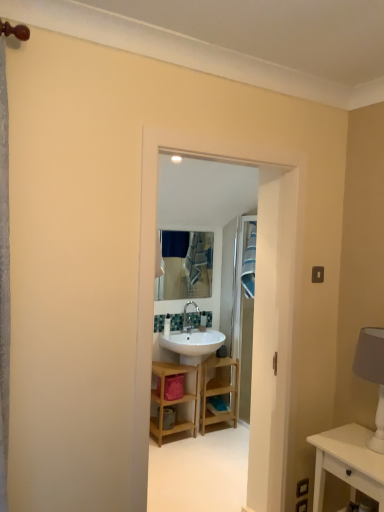
The image size is (384, 512). In order to click on wooden shelf at center in this screenshot , I will do `click(173, 400)`.

Measure the distance between white wood side table at lower right and camera.

The depth of white wood side table at lower right is 5.68 feet.

Measure the distance between blue fabric laundry at center and camera.

blue fabric laundry at center and camera are 3.49 meters apart from each other.

You are a GUI agent. You are given a task and a screenshot of the screen. Output one action in this format:
    pyautogui.click(x=<x>, y=<y>)
    Task: Click on the blue fabric laundry at center
    
    Given the screenshot: What is the action you would take?
    pyautogui.click(x=249, y=260)

What do you see at coordinates (186, 265) in the screenshot? The width and height of the screenshot is (384, 512). I see `metallic silver mirror at center` at bounding box center [186, 265].

Measure the distance between point (377, 362) and camera.

They are 1.91 meters apart.

Identify the location of wooden shelf at center. (173, 400).

Is blue fabric laundry at center with white wood side table at lower right?

There is a gap between blue fabric laundry at center and white wood side table at lower right.

Is the position of blue fabric laundry at center more distant than that of white wood side table at lower right?

That is True.

From a real-world perspective, who is located lower, blue fabric laundry at center or white wood side table at lower right?

From a 3D spatial view, white wood side table at lower right is below.

Is white wood side table at lower right completely or partially inside blue fabric laundry at center?

No.

Which of these two, wooden shelf at center or white wood side table at lower right, is bigger?

wooden shelf at center is bigger.

Can we say wooden shelf at center lies outside white wood side table at lower right?

wooden shelf at center lies outside white wood side table at lower right's area.

From the image's perspective, would you say wooden shelf at center is shown under white wood side table at lower right?

Yes, from the image's perspective, wooden shelf at center is beneath white wood side table at lower right.

Which of these two, wooden shelf at center or white wood side table at lower right, stands taller?

Standing taller between the two is wooden shelf at center.

Are wooden shelf at center and white wood side table at lower right located far from each other?

That's right, there is a large distance between wooden shelf at center and white wood side table at lower right.

From the image's perspective, is wooden shelf at center below white wood side table at lower right?

Yes, from the image's perspective, wooden shelf at center is below white wood side table at lower right.

Is wooden shelf at center wider than metallic silver mirror at center?

Yes, wooden shelf at center is wider than metallic silver mirror at center.

Is wooden shelf at center with metallic silver mirror at center?

wooden shelf at center is not next to metallic silver mirror at center, and they're not touching.

Is wooden shelf at center oriented towards metallic silver mirror at center?

No, wooden shelf at center is not turned towards metallic silver mirror at center.

Consider the image. Measure the distance from wooden shelf at center to metallic silver mirror at center.

wooden shelf at center and metallic silver mirror at center are 1.19 meters apart.

Consider the image. Can you tell me how much wooden shelf at center and blue fabric laundry at center differ in facing direction?

The angle between the facing direction of wooden shelf at center and the facing direction of blue fabric laundry at center is 85.5 degrees.

Looking at this image, measure the distance from wooden shelf at center to blue fabric laundry at center.

wooden shelf at center and blue fabric laundry at center are 34.49 inches apart from each other.

Is wooden shelf at center facing towards blue fabric laundry at center?

No, wooden shelf at center is not facing towards blue fabric laundry at center.

Considering the relative positions of wooden shelf at center and blue fabric laundry at center in the image provided, is wooden shelf at center in front of blue fabric laundry at center?

No.

From the image's perspective, who appears lower, white fabric lampshade at right or metallic silver mirror at center?

white fabric lampshade at right is shown below in the image.

Can you tell me how much white fabric lampshade at right and metallic silver mirror at center differ in facing direction?

The angle between the facing direction of white fabric lampshade at right and the facing direction of metallic silver mirror at center is 87.8 degrees.

Which object is positioned more to the right, white fabric lampshade at right or metallic silver mirror at center?

white fabric lampshade at right is more to the right.

Looking at this image, is white fabric lampshade at right aimed at metallic silver mirror at center?

No, white fabric lampshade at right does not turn towards metallic silver mirror at center.

Consider the image. Is white glossy sink at center positioned with its back to blue fabric laundry at center?

No, white glossy sink at center's orientation is not away from blue fabric laundry at center.

Identify the location of laundry that is on the right side of white glossy sink at center. The height and width of the screenshot is (512, 384). (249, 260).

Is point (266, 387) closer or farther from the camera than point (248, 254)?

Point (266, 387) is closer to the camera than point (248, 254).

From a real-world perspective, is white glossy sink at center on blue fabric laundry at center?

Incorrect, from a real-world perspective, white glossy sink at center is lower than blue fabric laundry at center.

You are a GUI agent. You are given a task and a screenshot of the screen. Output one action in this format:
    pyautogui.click(x=<x>, y=<y>)
    Task: Click on the laundry on the left of the white wood side table at lower right
    This screenshot has width=384, height=512.
    Given the screenshot: What is the action you would take?
    pyautogui.click(x=249, y=260)

This screenshot has width=384, height=512. Find the location of `bathroom cabinet that is behind the white wood side table at lower right`. bathroom cabinet that is behind the white wood side table at lower right is located at coordinates (173, 400).

Based on their spatial positions, is wooden shelf at center or white fabric lampshade at right closer to white glossy sink at center?

Based on the image, white fabric lampshade at right appears to be nearer to white glossy sink at center.

From the image, which object appears to be farther from white fabric lampshade at right, white wood side table at lower right or blue fabric laundry at center?

The object further to white fabric lampshade at right is blue fabric laundry at center.

When comparing their distances from white glossy sink at center, does blue fabric laundry at center or white fabric lampshade at right seem closer?

Among the two, white fabric lampshade at right is located nearer to white glossy sink at center.

Based on their spatial positions, is white glossy sink at center or wooden shelf at center closer to white fabric lampshade at right?

white glossy sink at center.

Considering their positions, is white glossy sink at center positioned closer to white wood side table at lower right than wooden shelf at center?

The object closer to white wood side table at lower right is white glossy sink at center.

Considering their positions, is blue fabric laundry at center positioned further to white wood side table at lower right than wooden shelf at center?

blue fabric laundry at center is further to white wood side table at lower right.

Estimate the real-world distances between objects in this image. Which object is further from wooden shelf at center, white glossy sink at center or white fabric lampshade at right?

Among the two, white fabric lampshade at right is located further to wooden shelf at center.

Looking at the image, which one is located closer to white wood side table at lower right, white fabric lampshade at right or metallic silver mirror at center?

Based on the image, white fabric lampshade at right appears to be nearer to white wood side table at lower right.

At what (x,y) coordinates should I click in order to perform the action: click on mirror that lies between blue fabric laundry at center and wooden shelf at center from top to bottom. Please return your answer as a coordinate pair (x, y). The width and height of the screenshot is (384, 512). Looking at the image, I should click on (186, 265).

You are a GUI agent. You are given a task and a screenshot of the screen. Output one action in this format:
    pyautogui.click(x=<x>, y=<y>)
    Task: Click on the bathroom cabinet between white wood side table at lower right and blue fabric laundry at center in the front-back direction
    This screenshot has width=384, height=512.
    Given the screenshot: What is the action you would take?
    pyautogui.click(x=173, y=400)

Where is `laundry between white wood side table at lower right and wooden shelf at center along the z-axis`? laundry between white wood side table at lower right and wooden shelf at center along the z-axis is located at coordinates (249, 260).

The width and height of the screenshot is (384, 512). Identify the location of table lamp between white glossy sink at center and blue fabric laundry at center along the z-axis. (372, 375).